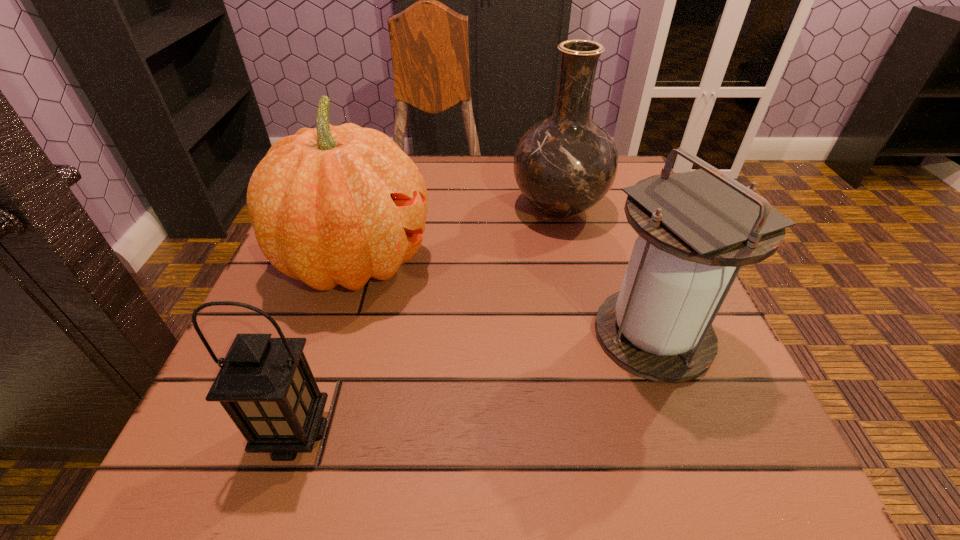
The image size is (960, 540). Identify the location of free spot between the right lantern and the nearer lantern. (474, 383).

The image size is (960, 540). Find the location of `vacant space that's between the left lantern and the vase`. vacant space that's between the left lantern and the vase is located at coordinates (427, 320).

The height and width of the screenshot is (540, 960). I want to click on vacant space in between the pumpkin and the vase, so click(457, 234).

The image size is (960, 540). I want to click on unoccupied area between the farther lantern and the vase, so click(x=606, y=271).

Locate an element on the screen. vacant space that's between the right lantern and the shortest object is located at coordinates pos(474,383).

At what (x,y) coordinates should I click in order to perform the action: click on vacant area that lies between the nearer lantern and the farther lantern. Please return your answer as a coordinate pair (x, y). Looking at the image, I should click on (474, 383).

Identify the location of vacant space in between the pumpkin and the nearest object. (325, 347).

Image resolution: width=960 pixels, height=540 pixels. What are the coordinates of `vacant space that is in between the farther lantern and the shorter lantern` in the screenshot? It's located at click(474, 383).

Identify the location of free space between the pumpkin and the vase. 457,234.

The image size is (960, 540). In order to click on free spot between the vase and the pumpkin in this screenshot , I will do `click(457, 234)`.